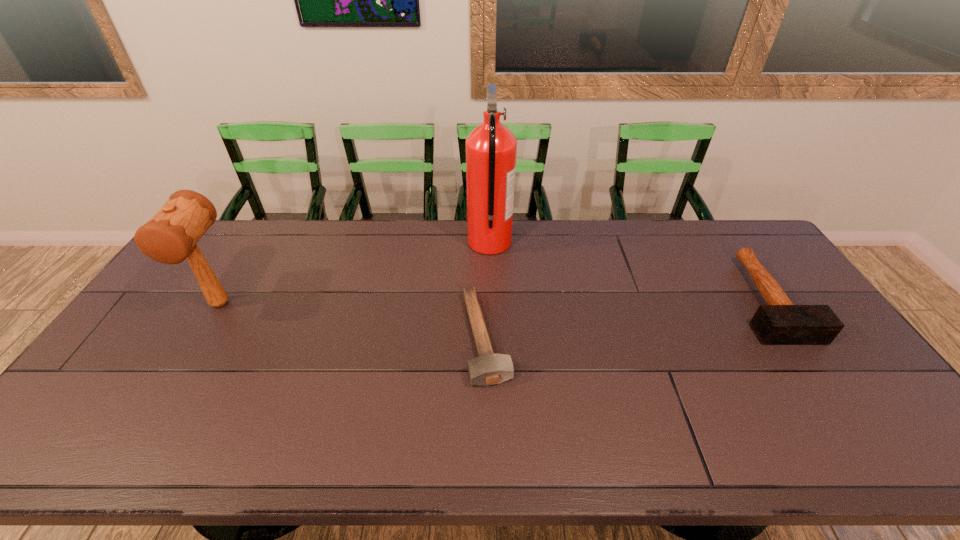
I want to click on the tallest object, so click(491, 148).

Image resolution: width=960 pixels, height=540 pixels. Find the location of `the second tallest object`. the second tallest object is located at coordinates coord(171,235).

Find the location of `the leftmost mallet`. the leftmost mallet is located at coordinates (171, 235).

The height and width of the screenshot is (540, 960). I want to click on the second shortest mallet, so click(780, 322).

The width and height of the screenshot is (960, 540). Identify the location of the rightmost object. (780, 322).

At what (x,y) coordinates should I click in order to perform the action: click on the shortest mallet. Please return your answer as a coordinate pair (x, y). Looking at the image, I should click on pyautogui.click(x=489, y=368).

Locate an element on the screen. This screenshot has height=540, width=960. the second mallet from right to left is located at coordinates (489, 368).

You are a GUI agent. You are given a task and a screenshot of the screen. Output one action in this format:
    pyautogui.click(x=<x>, y=<y>)
    Task: Click on the vacant space located 0.160m at the nozzle of the tallest object
    Image resolution: width=960 pixels, height=540 pixels.
    Given the screenshot: What is the action you would take?
    tap(422, 243)

Find the location of a particular element. The height and width of the screenshot is (540, 960). free space located at the nozzle of the tallest object is located at coordinates (372, 243).

The height and width of the screenshot is (540, 960). I want to click on free region located 0.150m at the nozzle of the tallest object, so pos(425,243).